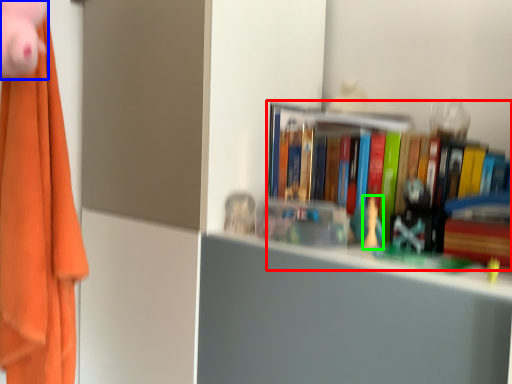
Question: Which is nearer to the book (highlighted by a red box)? toy (highlighted by a blue box) or toy (highlighted by a green box).

Choices:
 (A) toy
 (B) toy

Answer: (B)